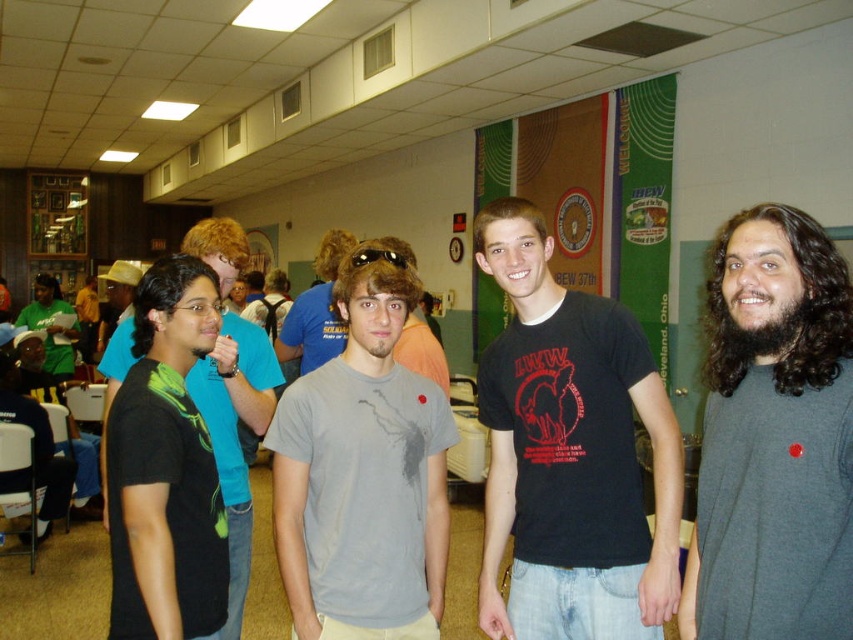
Question: Estimate the real-world distances between objects in this image. Which object is farther from the black matte t-shirt at center?

Choices:
 (A) black matte t-shirt at left
 (B) dark gray matte shirt at right
 (C) gray cotton t-shirt at center

Answer: (C)

Question: Considering the relative positions of gray matte t-shirt at center and black matte t-shirt at left in the image provided, where is gray matte t-shirt at center located with respect to black matte t-shirt at left?

Choices:
 (A) below
 (B) above

Answer: (B)

Question: Which of the following is the farthest from the observer?

Choices:
 (A) black matte t-shirt at left
 (B) black matte t-shirt at center
 (C) dark gray matte shirt at right
 (D) matte green shirt at left

Answer: (D)

Question: Is black matte t-shirt at center wider than gray matte t-shirt at center?

Choices:
 (A) yes
 (B) no

Answer: (A)

Question: Which object is closer to the camera taking this photo?

Choices:
 (A) gray matte t-shirt at center
 (B) matte green shirt at left
 (C) dark gray matte shirt at right
 (D) gray cotton t-shirt at center

Answer: (C)

Question: Does black matte t-shirt at center appear on the left side of black matte t-shirt at left?

Choices:
 (A) no
 (B) yes

Answer: (A)